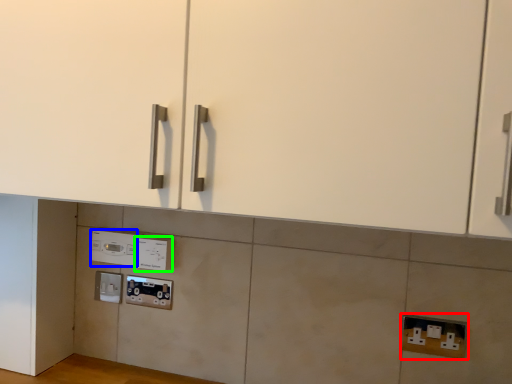
Question: Considering the real-world distances, which object is farthest from electric outlet (highlighted by a red box)? appliance (highlighted by a blue box) or electric outlet (highlighted by a green box)?

Choices:
 (A) appliance
 (B) electric outlet

Answer: (A)